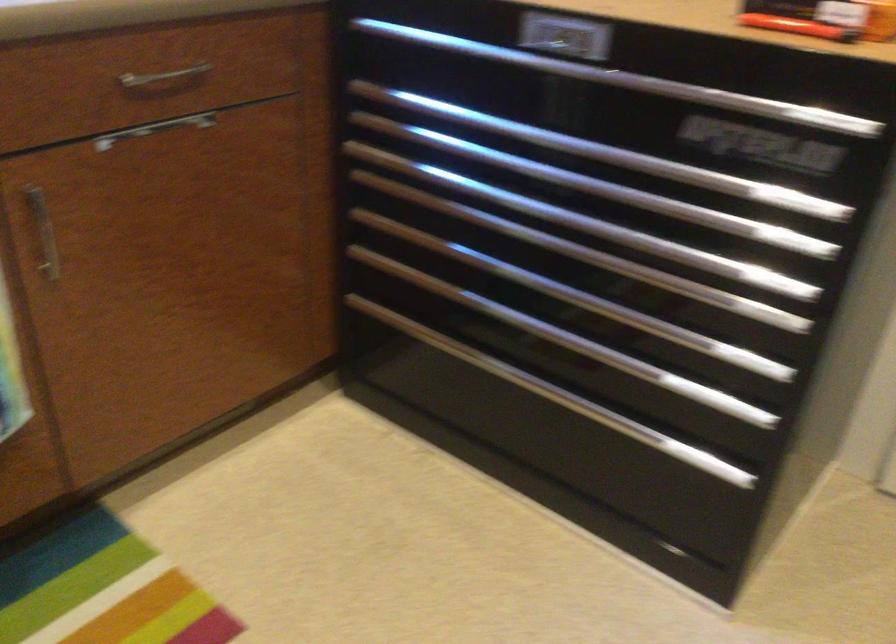
Find the location of `silver cabinet pull`. silver cabinet pull is located at coordinates (42, 232).